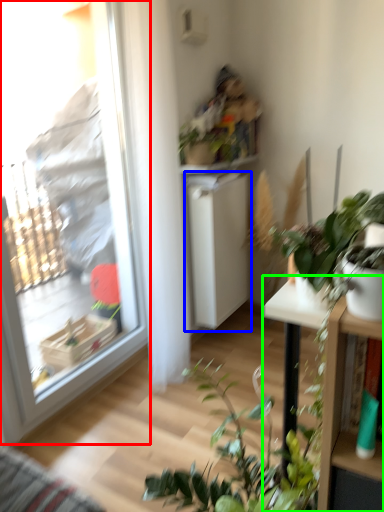
Question: Estimate the real-world distances between objects in this image. Which object is closer to window (highlighted by a red box), shelf (highlighted by a blue box) or table (highlighted by a green box)?

Choices:
 (A) shelf
 (B) table

Answer: (A)